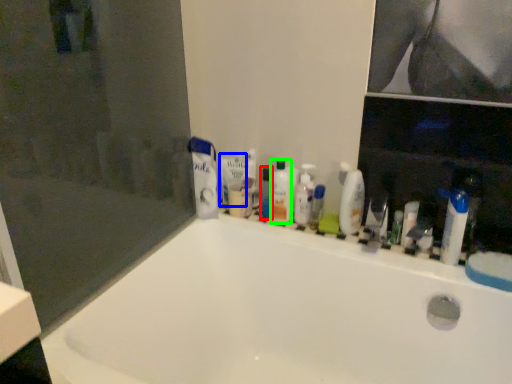
Question: Estimate the real-world distances between objects in this image. Which object is farther from toiletry (highlighted by a red box), toothpaste (highlighted by a blue box) or mouthwash (highlighted by a green box)?

Choices:
 (A) toothpaste
 (B) mouthwash

Answer: (A)